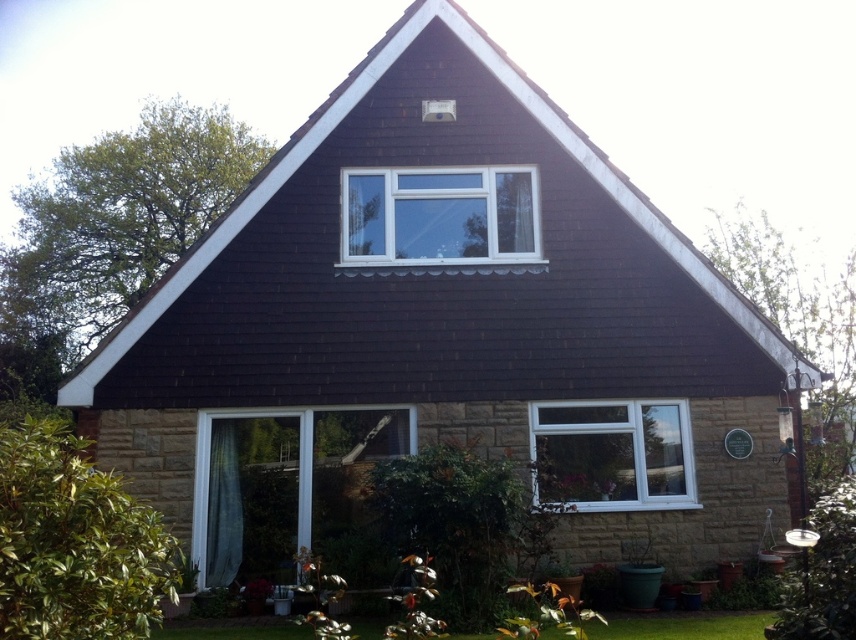
You are standing in the front yard of the house and want to place a 10 feet long garden bench between the white plastic window at center and the green grass at lower center. Is there enough space for the bench?

The distance between the white plastic window at center and the green grass at lower center is 15.47 feet, which is more than enough to accommodate a 10 feet long garden bench.

You are standing at the transparent glass window at lower center and want to reach the front door. The path is straight. Your toy car can move 2 meters per second. How long will it take for the toy car to reach the front door?

The distance between the transparent glass window at lower center and the front door is 9.65 meters. Since the toy car moves at 2 meters per second, it will take approximately 4.825 seconds to reach the front door.